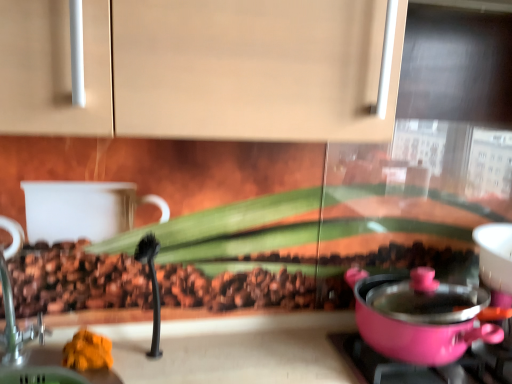
Question: Is the depth of pink plastic pot at right greater than that of orange soft food at lower left?

Choices:
 (A) yes
 (B) no

Answer: (B)

Question: Does pink plastic pot at right have a greater height compared to orange soft food at lower left?

Choices:
 (A) yes
 (B) no

Answer: (A)

Question: Can you confirm if pink plastic pot at right is positioned to the right of orange soft food at lower left?

Choices:
 (A) yes
 (B) no

Answer: (A)

Question: Can you confirm if pink plastic pot at right is bigger than orange soft food at lower left?

Choices:
 (A) yes
 (B) no

Answer: (A)

Question: Is pink plastic pot at right at the left side of orange soft food at lower left?

Choices:
 (A) no
 (B) yes

Answer: (A)

Question: Visually, is pink plastic pot at lower right positioned to the left or to the right of brushed metal faucet at left?

Choices:
 (A) right
 (B) left

Answer: (A)

Question: Is point [x=371, y=370] positioned closer to the camera than point [x=7, y=289]?

Choices:
 (A) closer
 (B) farther

Answer: (A)

Question: Is pink plastic pot at lower right taller or shorter than brushed metal faucet at left?

Choices:
 (A) tall
 (B) short

Answer: (B)

Question: From the image's perspective, relative to brushed metal faucet at left, is pink plastic pot at lower right above or below?

Choices:
 (A) above
 (B) below

Answer: (B)

Question: Considering their positions, is pink plastic pot at lower right located in front of or behind pink plastic pot at right?

Choices:
 (A) front
 (B) behind

Answer: (B)

Question: From their relative heights in the image, would you say pink plastic pot at lower right is taller or shorter than pink plastic pot at right?

Choices:
 (A) tall
 (B) short

Answer: (B)

Question: From a real-world perspective, is pink plastic pot at lower right physically located above or below pink plastic pot at right?

Choices:
 (A) above
 (B) below

Answer: (B)

Question: Is pink plastic pot at lower right to the left or to the right of pink plastic pot at right in the image?

Choices:
 (A) right
 (B) left

Answer: (A)

Question: Which is correct: pink plastic pot at lower right is inside orange soft food at lower left, or outside of it?

Choices:
 (A) outside
 (B) inside

Answer: (A)

Question: Is point (398, 380) positioned closer to the camera than point (110, 359)?

Choices:
 (A) closer
 (B) farther

Answer: (B)